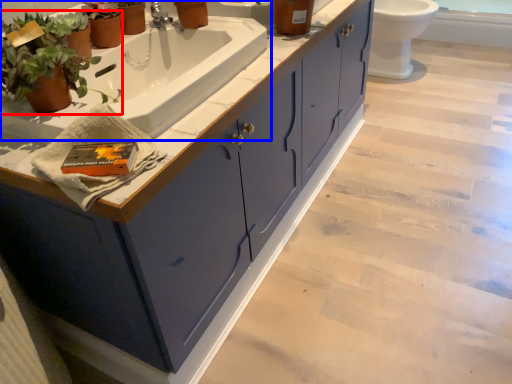
Question: Which of the following is the closest to the observer, houseplant (highlighted by a red box) or sink (highlighted by a blue box)?

Choices:
 (A) houseplant
 (B) sink

Answer: (A)